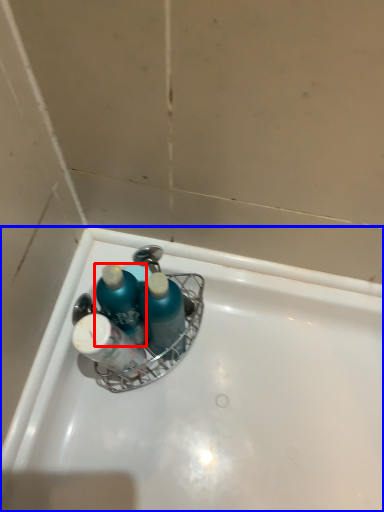
Question: Which point is closer to the camera, mouthwash (highlighted by a red box) or bathtub (highlighted by a blue box)?

Choices:
 (A) mouthwash
 (B) bathtub

Answer: (A)